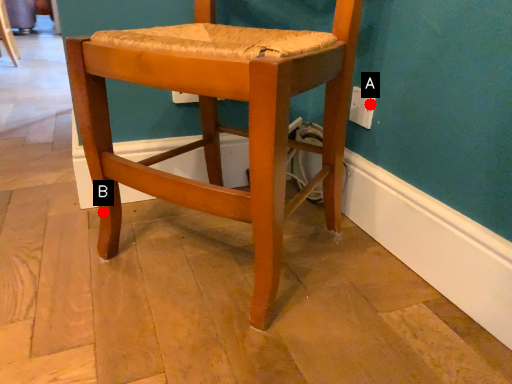
Question: Two points are circled on the image, labeled by A and B beside each circle. Which point is farther from the camera taking this photo?

Choices:
 (A) A is further
 (B) B is further

Answer: (A)